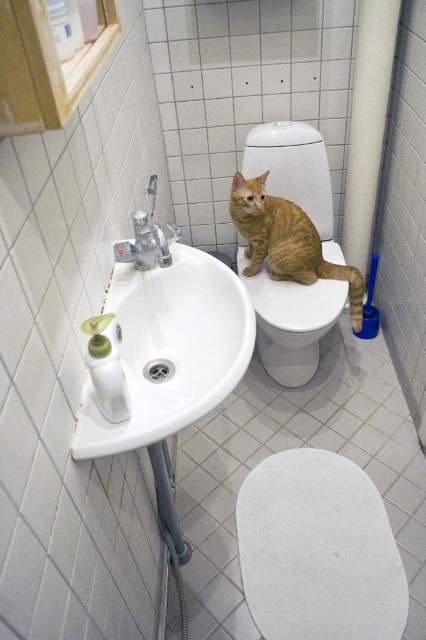
In the scene shown: You are a plumber inspecting the bathroom and need to access the satin nickel faucet at sink left. There is an orange tabby cat at center blocking your path. Can you move the cat to reach the faucet?

The orange tabby cat at center is bigger than the satin nickel faucet at sink left, but size does not determine if it can be moved. You should carefully move the cat to access the faucet.

You are standing in the bathroom and want to reach the point at coordinates (328,275). The sink is between you and that point. Can you move around the sink to reach it?

The point at coordinates (328,275) is 6.12 feet away from the viewer. Since the sink is between you and the point, you would need to move around the sink to reach it, but the sink is a physical barrier. However, the distance of 6.12 feet suggests that the point might be within reach if you can navigate around the sink. However, without knowing the sink dimensions, it is uncertain. The answer is inconclusive based on the given information.